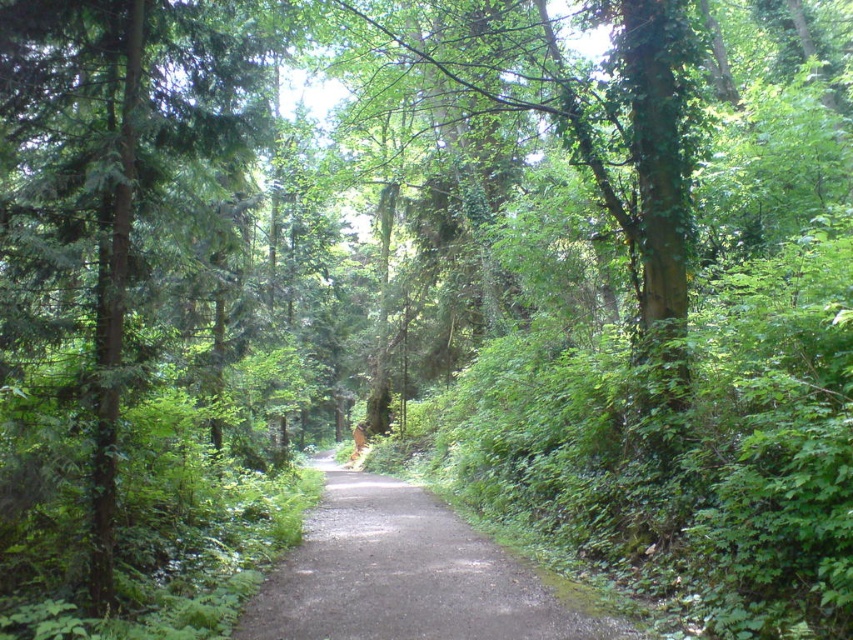
Can you confirm if green matte tree at left is taller than dull gray asphalt at center?

Incorrect, green matte tree at left's height is not larger of dull gray asphalt at center's.

Looking at this image, who is higher up, green matte tree at left or dull gray asphalt at center?

green matte tree at left is above.

Does point (9, 64) come behind point (421, 512)?

No, it is in front of (421, 512).

Find the location of `green matte tree at left`. green matte tree at left is located at coordinates (102, 257).